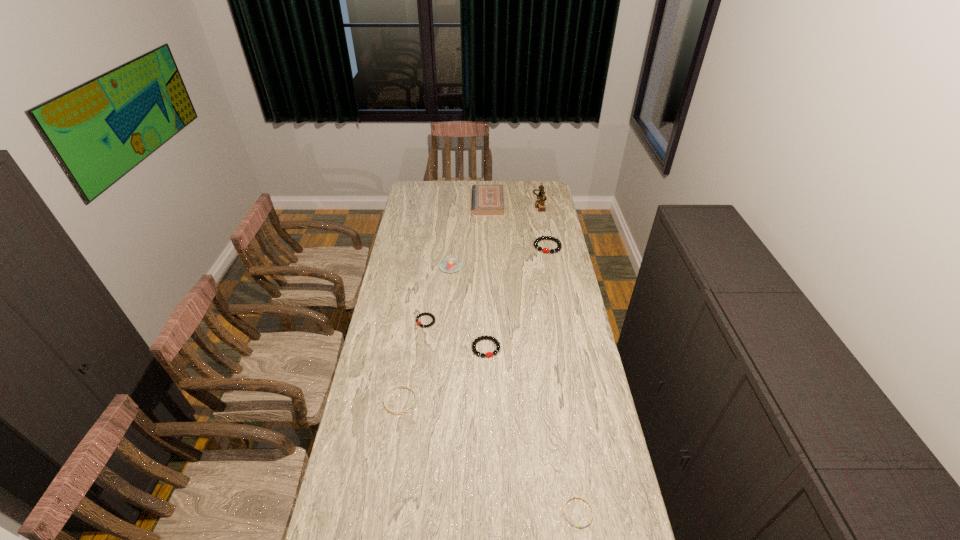
This screenshot has width=960, height=540. I want to click on the closest black bracelet to the sixth nearest object, so click(x=489, y=354).

Where is `free point that satisfies the following two spatial constraints: 1. on the back side of the pastry; 2. on the right side of the smallest black bracelet`? free point that satisfies the following two spatial constraints: 1. on the back side of the pastry; 2. on the right side of the smallest black bracelet is located at coordinates (433, 267).

Locate an element on the screen. free location that satisfies the following two spatial constraints: 1. on the front-facing side of the tallest bracelet; 2. on the left side of the telephone is located at coordinates (547, 246).

At what (x,y) coordinates should I click in order to perform the action: click on free point that satisfies the following two spatial constraints: 1. on the front-facing side of the brown telephone; 2. on the surface of the shortest bracelet showing star-shaped elements. Please return your answer as a coordinate pair (x, y). Looking at the image, I should click on (597, 512).

In order to click on free spot that satisfies the following two spatial constraints: 1. on the spine side of the blue Bible; 2. on the front side of the third bracelet from right to left in this screenshot , I will do `click(492, 348)`.